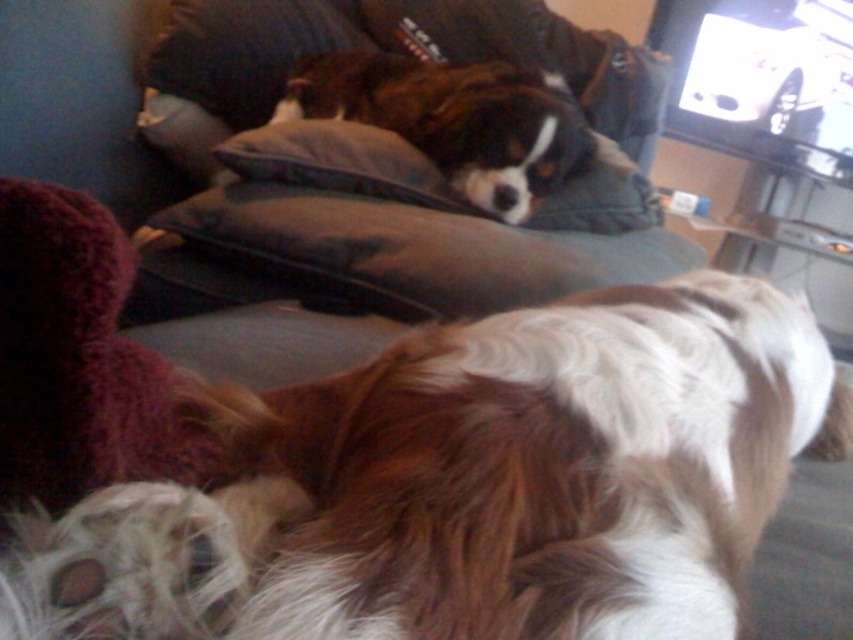
Question: Does dark gray cushion at center come in front of dark gray fabric pillow at upper center?

Choices:
 (A) yes
 (B) no

Answer: (A)

Question: Which object is positioned closest to the dark gray cushion at center?

Choices:
 (A) dark gray fabric pillow at upper center
 (B) brown fur dog at center

Answer: (B)

Question: Is brown and white fur at center positioned before dark gray cushion at center?

Choices:
 (A) yes
 (B) no

Answer: (A)

Question: Which point is closer to the camera taking this photo?

Choices:
 (A) (402, 314)
 (B) (370, 52)
 (C) (323, 600)

Answer: (C)

Question: In this image, where is dark gray cushion at center located relative to dark gray fabric pillow at upper center?

Choices:
 (A) left
 (B) right

Answer: (B)

Question: Which object is farther from the camera taking this photo?

Choices:
 (A) dark gray fabric pillow at upper center
 (B) dark gray cushion at center
 (C) brown fur dog at center
 (D) brown and white fur at center

Answer: (A)